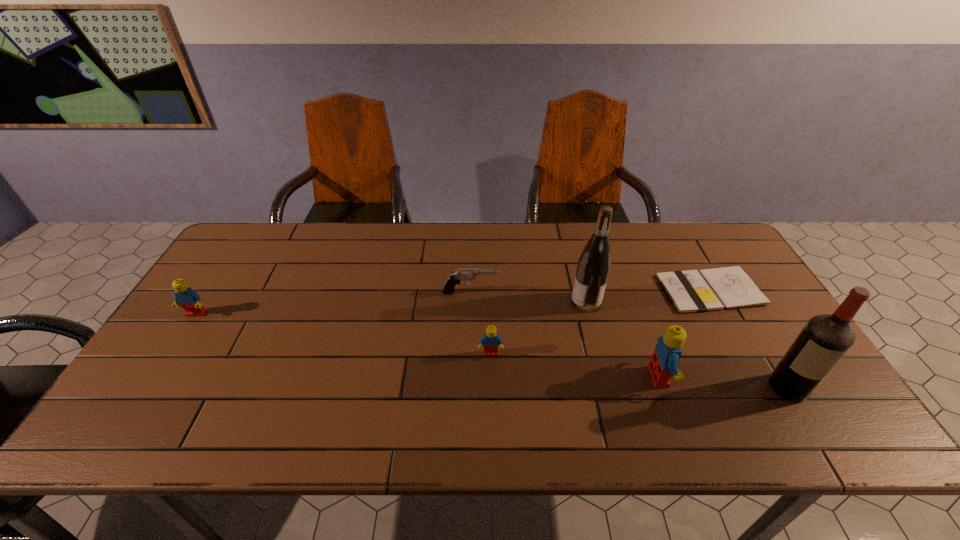
You are a GUI agent. You are given a task and a screenshot of the screen. Output one action in this format:
    pyautogui.click(x=<x>, y=<y>)
    Task: Click on the location for an additional Lego to make spacing equal
    Image resolution: width=960 pixels, height=540 pixels.
    Given the screenshot: What is the action you would take?
    pyautogui.click(x=337, y=333)